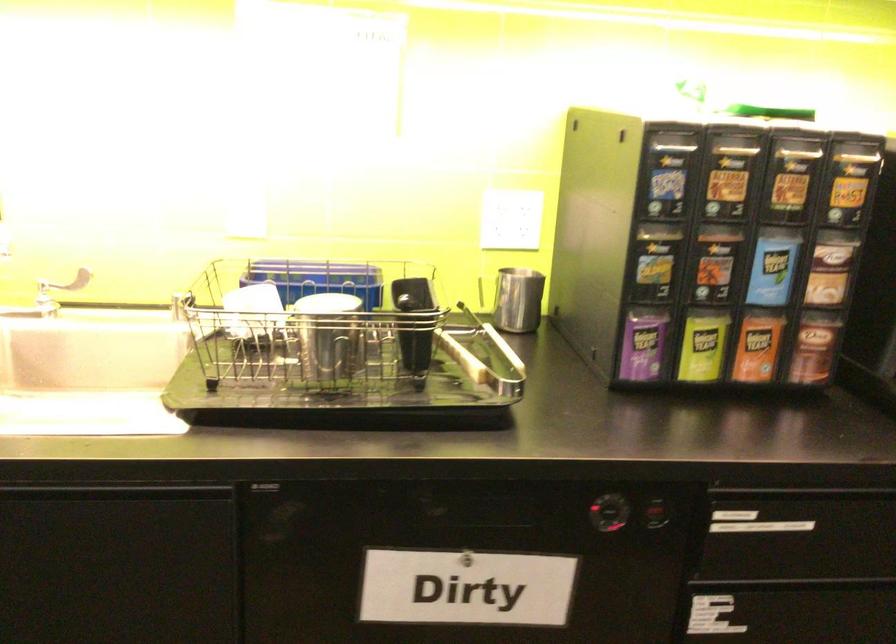
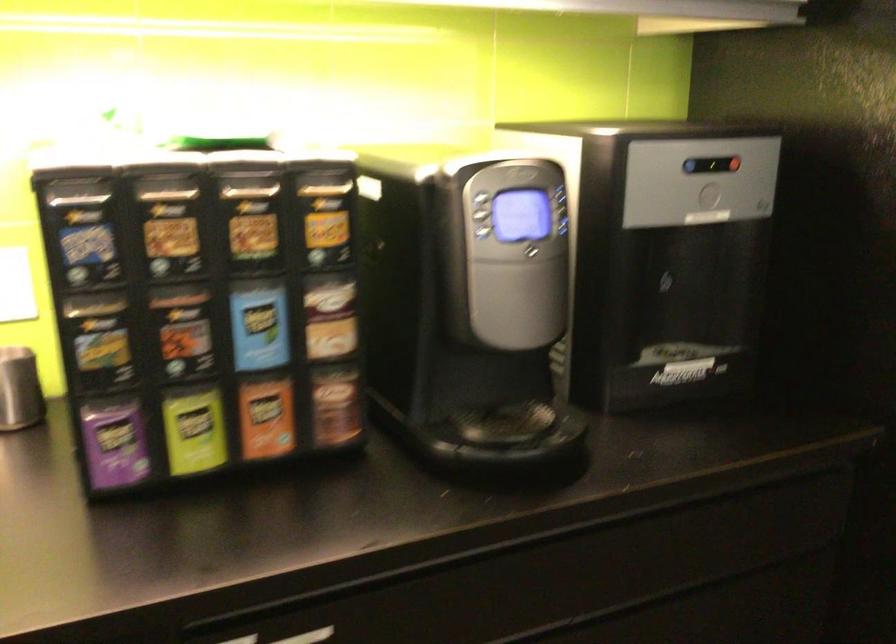
In the second image, find the point that corresponds to [702,346] in the first image.

(194, 430)